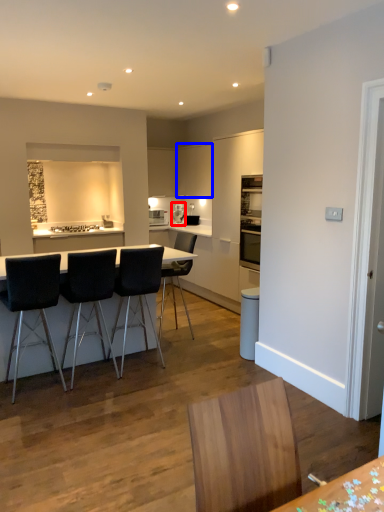
Question: Which of the following is the farthest to the observer, coffee machine (highlighted by a red box) or cabinetry (highlighted by a blue box)?

Choices:
 (A) coffee machine
 (B) cabinetry

Answer: (A)